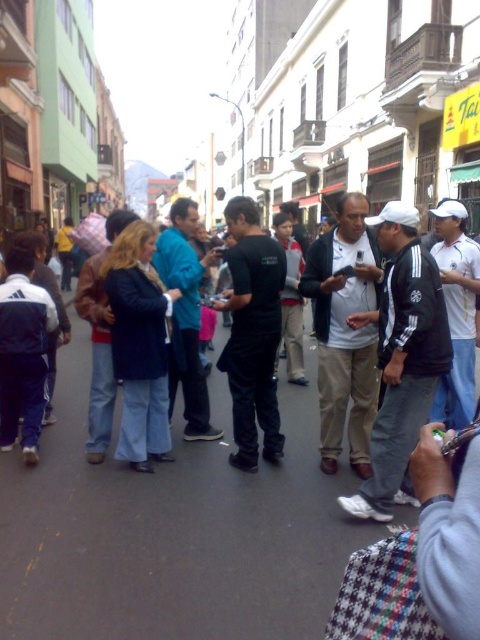
Which is above, black matte shirt at center or blue denim jeans at center?

Positioned higher is blue denim jeans at center.

Does point (261, 241) come closer to viewer compared to point (122, 355)?

No, (261, 241) is further to viewer.

Which is behind, point (242, 268) or point (112, 312)?

The point (112, 312) is more distant.

The image size is (480, 640). Identify the location of black matte shirt at center. (252, 333).